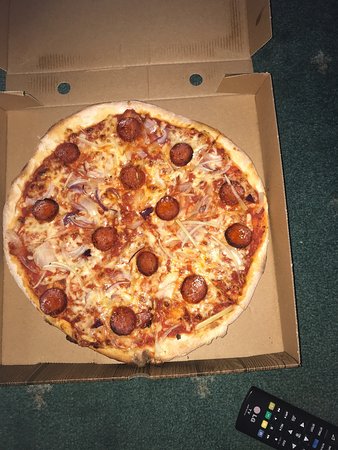
Locate an element on the screen. This screenshot has height=450, width=338. scuff in carpet is located at coordinates (204, 383).